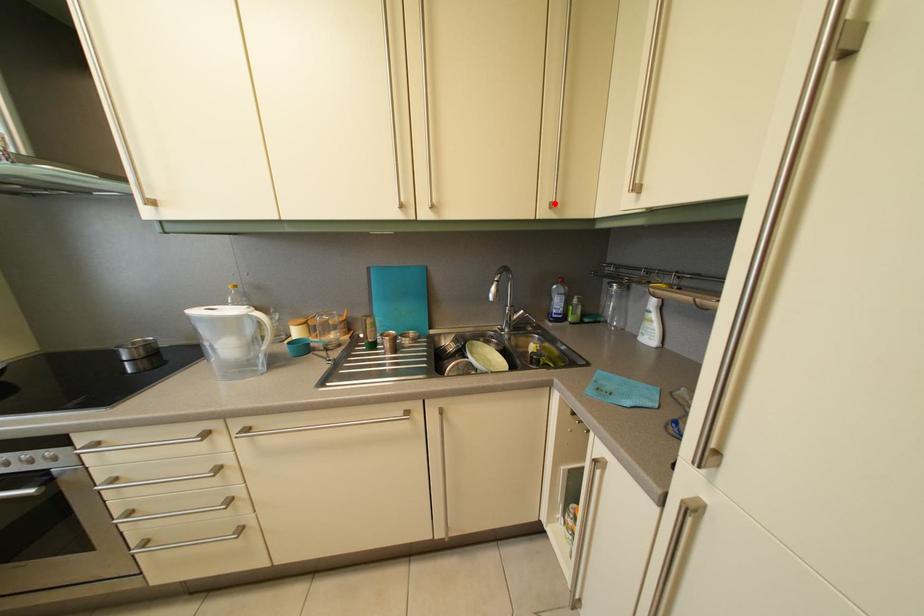
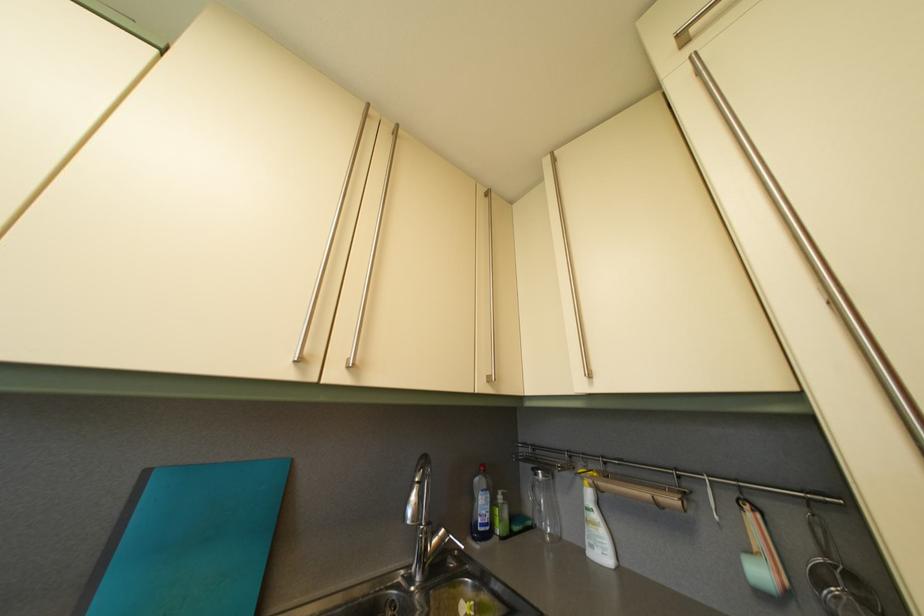
Where in the second image is the point corresponding to the highlighted location from the first image?

(492, 376)